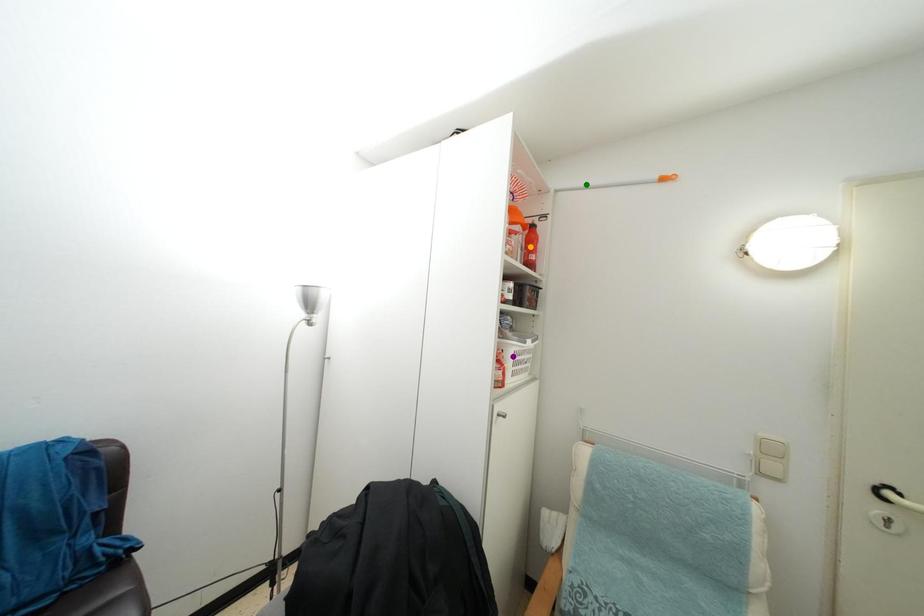
Order these from nearest to farthest:
A) orange point
B) green point
C) purple point

green point < purple point < orange point